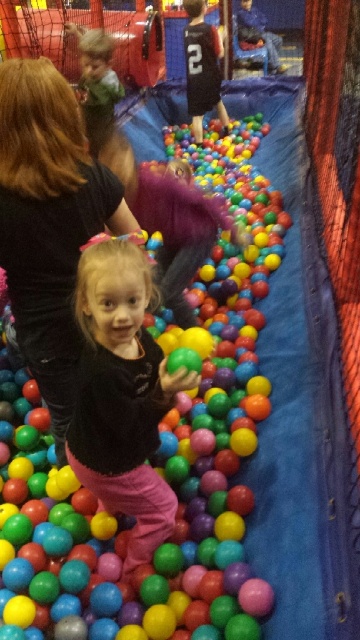
You are standing in the ball pit and want to reach both the point at coordinates point (0, 316) and point (38, 316). Which one would you need to reach first if you move forward in a straight line?

You would need to reach point (0, 316) first because it is closer to you than point (38, 316), which is further away.

You are a photographer trying to set up a tripod in the ball pit. You need to place it near the black fabric at upper left. According to the coordinates provided, where exactly should you position the tripod?

The black fabric at upper left is located at coordinates point (48, 221), so you should position the tripod near that point.

You are a parent watching your child play in the ball pit. You notice the matte plastic ball at center and the black fabric at upper left. Which object is positioned higher in the image?

The matte plastic ball at center is positioned higher than the black fabric at upper left.